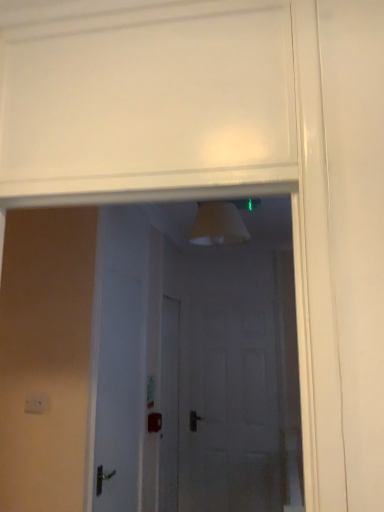
Find the location of a particular element. white matte door at center is located at coordinates (229, 408).

What do you see at coordinates (229, 408) in the screenshot?
I see `white matte door at center` at bounding box center [229, 408].

Find the location of a particular element. white matte door at center is located at coordinates (118, 391).

What is the approximate width of white matte door at center?

white matte door at center is 2.13 inches in width.

What do you see at coordinates (118, 391) in the screenshot? This screenshot has height=512, width=384. I see `white matte door at center` at bounding box center [118, 391].

At what (x,y) coordinates should I click in order to perform the action: click on white matte door at center. Please return your answer as a coordinate pair (x, y). This screenshot has height=512, width=384. Looking at the image, I should click on (229, 408).

Is white matte door at center at the left side of white matte door at center?

Incorrect, white matte door at center is not on the left side of white matte door at center.

Is white matte door at center positioned in front of white matte door at center?

That is False.

Between point (218, 316) and point (114, 481), which one is positioned behind?

The point (218, 316) is behind.

From the image's perspective, which one is positioned lower, white matte door at center or white matte door at center?

white matte door at center is shown below in the image.

From a real-world perspective, is white matte door at center on white matte door at center?

No, from a real-world perspective, white matte door at center is not on top of white matte door at center.

Is white matte door at center thinner than white matte door at center?

No.

Is white matte door at center taller or shorter than white matte door at center?

Clearly, white matte door at center is taller compared to white matte door at center.

Who is smaller, white matte door at center or white matte door at center?

With smaller size is white matte door at center.

Is white matte door at center situated inside white matte door at center or outside?

white matte door at center exists outside the volume of white matte door at center.

Is the surface of white matte door at center in direct contact with white matte door at center?

No, white matte door at center is not in contact with white matte door at center.

Is white matte door at center at the back of white matte door at center?

No, white matte door at center is not facing away from white matte door at center.

The height and width of the screenshot is (512, 384). In order to click on door located in front of the white matte door at center in this screenshot , I will do `click(118, 391)`.

Which object is positioned more to the left, white matte door at center or white matte door at center?

Positioned to the left is white matte door at center.

Which object is closer to the camera, white matte door at center or white matte door at center?

white matte door at center is in front.

Is point (110, 394) closer to camera compared to point (219, 481)?

Yes, point (110, 394) is closer to viewer.

From the image's perspective, which is above, white matte door at center or white matte door at center?

white matte door at center, from the image's perspective.

From a real-world perspective, is white matte door at center beneath white matte door at center?

Actually, white matte door at center is physically above white matte door at center in the real world.

Looking at their sizes, would you say white matte door at center is wider or thinner than white matte door at center?

Considering their sizes, white matte door at center looks slimmer than white matte door at center.

Which of these two, white matte door at center or white matte door at center, stands taller?

With more height is white matte door at center.

Is white matte door at center bigger than white matte door at center?

Actually, white matte door at center might be smaller than white matte door at center.

Is white matte door at center not inside white matte door at center?

Absolutely, white matte door at center is external to white matte door at center.

Is white matte door at center not near white matte door at center?

That's right, there is a large distance between white matte door at center and white matte door at center.

Is white matte door at center looking in the opposite direction of white matte door at center?

No, white matte door at center is not at the back of white matte door at center.

What's the angular difference between white matte door at center and white matte door at center's facing directions?

white matte door at center and white matte door at center are facing 89.7 degrees away from each other.

How much distance is there between white matte door at center and white matte door at center?

white matte door at center and white matte door at center are 1.38 meters apart.

I want to click on screen door below the white matte door at center (from the image's perspective), so click(x=229, y=408).

Locate an element on the screen. The image size is (384, 512). screen door behind the white matte door at center is located at coordinates (229, 408).

There is a white matte door at center. Where is `door above it (from a real-world perspective)`? The image size is (384, 512). door above it (from a real-world perspective) is located at coordinates (118, 391).